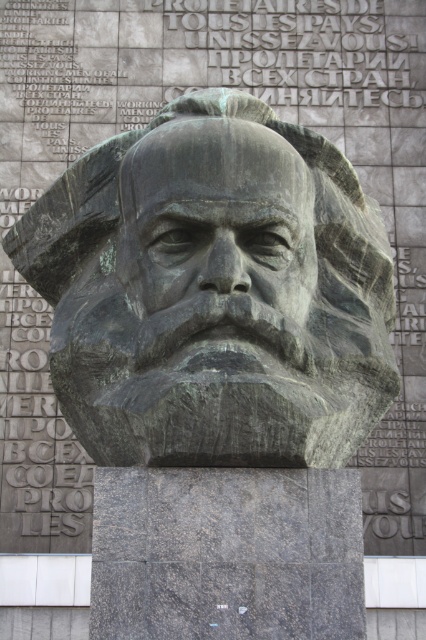
You are standing in front of the bronze statue at center and want to touch its head, the bronze statue head at center. Can you reach it without moving your position?

The bronze statue at center is further to the viewer than bronze statue head at center, meaning the head is positioned behind the main statue. Since the head is behind the statue, you cannot reach it without moving your position.